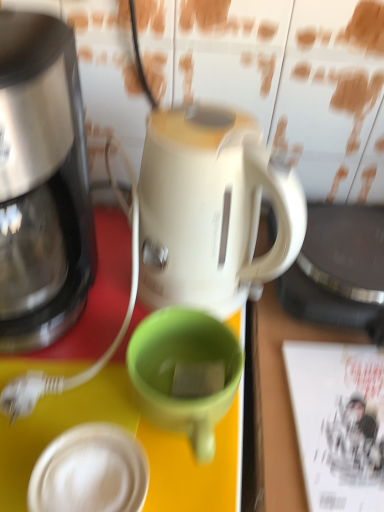
Image resolution: width=384 pixels, height=512 pixels. Identify the location of vacant space to the left of green matte mug at center. (64, 391).